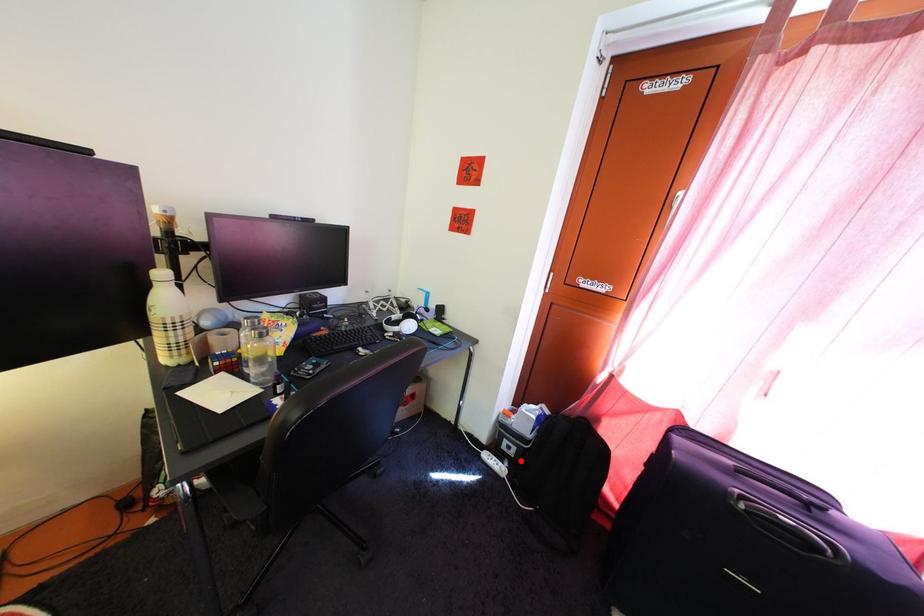
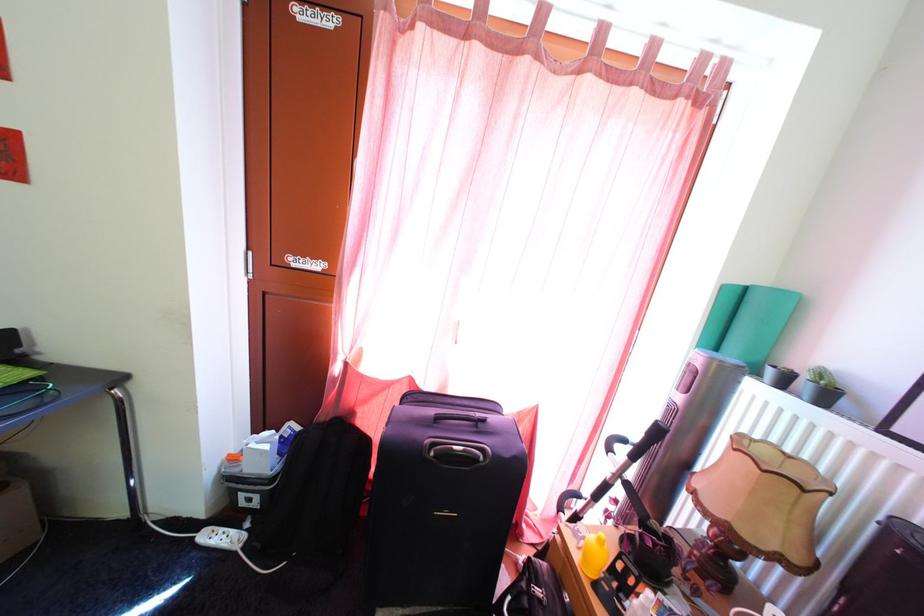
Question: I am providing you with two images of the same scene from different viewpoints. In image1, a red point is highlighted. Considering the same 3D point in image2, which of the following is correct?

Choices:
 (A) It is closer
 (B) It is farther

Answer: (A)